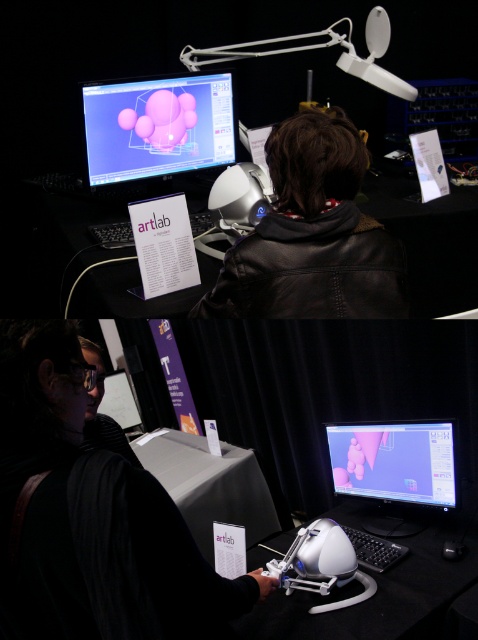
Question: Among these points, which one is nearest to the camera?

Choices:
 (A) tap(131, 561)
 (B) tap(321, 246)
 (C) tap(395, 93)

Answer: (A)

Question: Is matte pink sphere at upper center closer to the viewer compared to white matte helmet at center?

Choices:
 (A) no
 (B) yes

Answer: (A)

Question: Which object is positioned closest to the leather jacket at center?

Choices:
 (A) matte pink sphere at upper center
 (B) white plastic table at center
 (C) white plastic lamp at upper center
 (D) matte plastic monitor at center

Answer: (D)

Question: Among these points, which one is nearest to the camera?

Choices:
 (A) (312, 44)
 (B) (163, 93)

Answer: (B)

Question: Does black matte jacket at center lie in front of matte plastic monitor at center?

Choices:
 (A) no
 (B) yes

Answer: (B)

Question: In this image, where is white plastic table at center located relative to white matte helmet at center?

Choices:
 (A) left
 (B) right

Answer: (B)